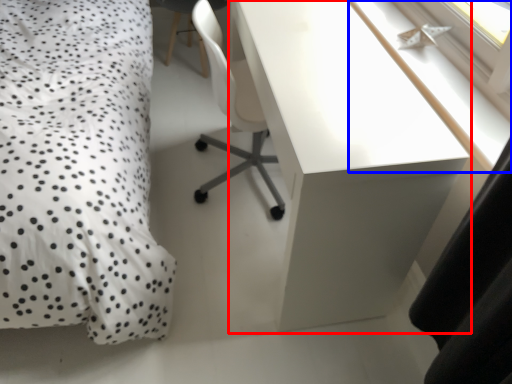
Question: Among these objects, which one is nearest to the camera, desk (highlighted by a red box) or window sill (highlighted by a blue box)?

Choices:
 (A) desk
 (B) window sill

Answer: (A)